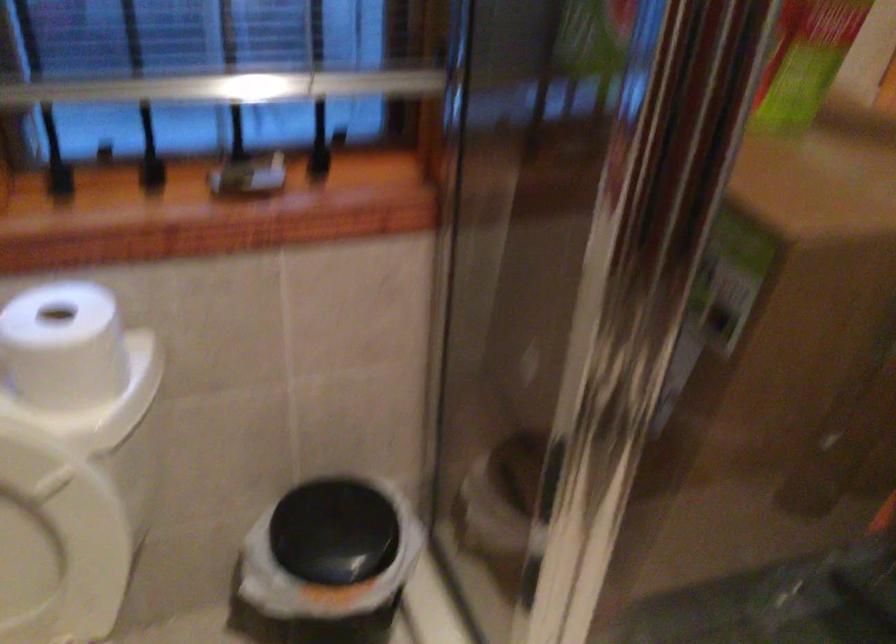
This screenshot has width=896, height=644. Describe the element at coordinates (56, 541) in the screenshot. I see `a white toilet seat` at that location.